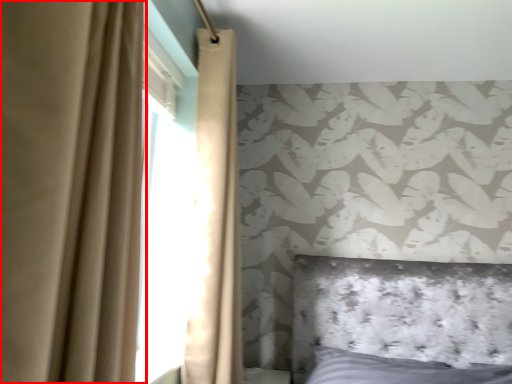
Question: From the image's perspective, where is curtain (annotated by the red box) located in relation to curtain in the image?

Choices:
 (A) above
 (B) below

Answer: (A)